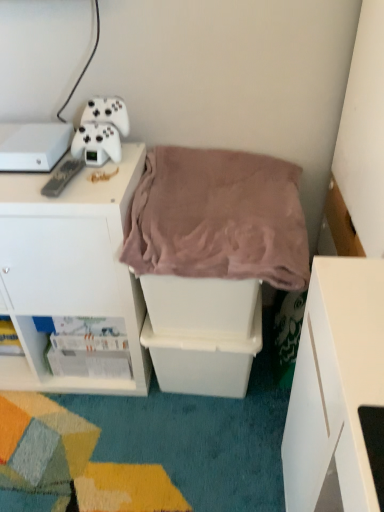
Locate an element on the screen. The width and height of the screenshot is (384, 512). vacant space in front of black plastic remote at upper left is located at coordinates (64, 199).